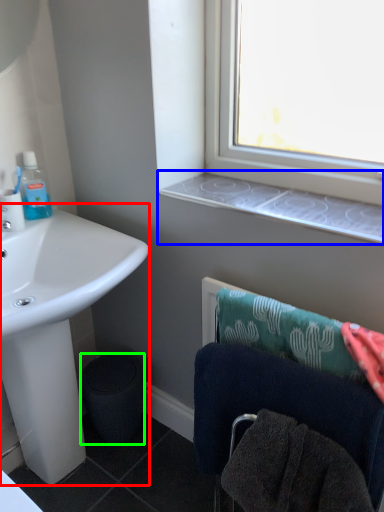
Question: Which object is positioned farthest from sink (highlighted by a red box)? Select from window sill (highlighted by a blue box) and trash bin/can (highlighted by a green box).

Choices:
 (A) window sill
 (B) trash bin/can

Answer: (A)